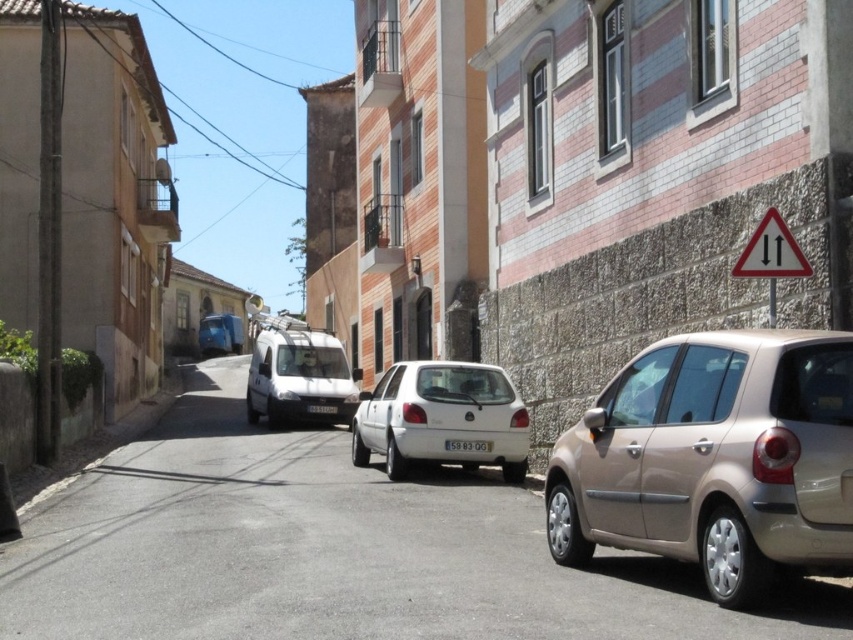
You are standing at the entrance of the street and want to find the white matte hatchback at center. According to the coordinates provided, where would you look relative to the entrance?

The white matte hatchback at center is located at coordinates 0.653 on the x axis and 0.518 on the y axis relative to the entrance.

Looking at this image, you are a delivery driver trying to park your truck between the white matte hatchback at center and the metallic blue van at center. Based on their sizes, which vehicle should you position closer to the curb to ensure enough space?

The white matte hatchback at center is bigger than the metallic blue van at center, so you should position the metallic blue van closer to the curb to leave more space for the larger vehicle.

You are driving a gold metallic hatchback at right and want to back out of your parking spot. There is a white matte hatchback at center behind you. Can you safely back out without hitting the car behind you?

The gold metallic hatchback at right is in front of the white matte hatchback at center, meaning the white car is behind it. Since the gold car is in front, it can safely back out as long as there is enough space behind it, but the description does not provide specific distance measurements. However, since the white car is behind, backing out carefully should be possible without collision.